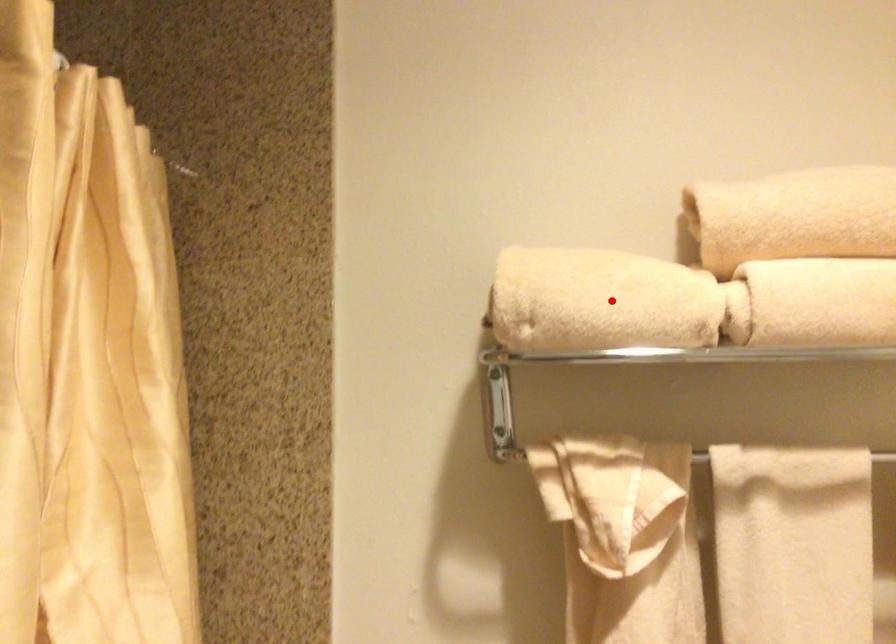
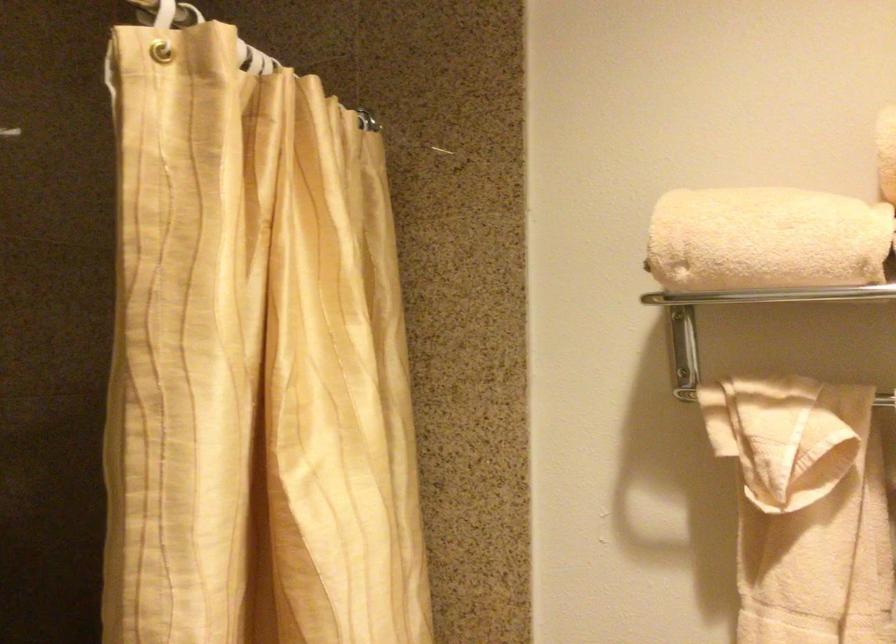
The point at the highlighted location is marked in the first image. Where is the corresponding point in the second image?

(765, 240)